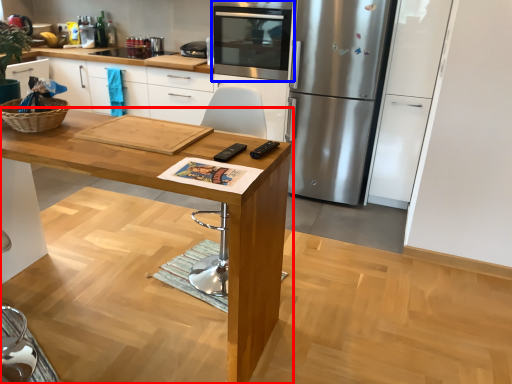
Question: Which object is further to the camera taking this photo, table (highlighted by a red box) or home appliance (highlighted by a blue box)?

Choices:
 (A) table
 (B) home appliance

Answer: (B)